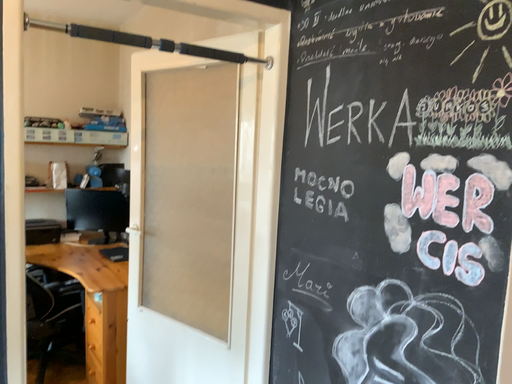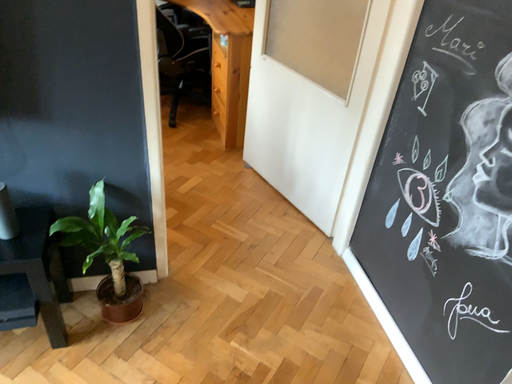
Question: How did the camera likely rotate when shooting the video?

Choices:
 (A) rotated left
 (B) rotated right

Answer: (A)